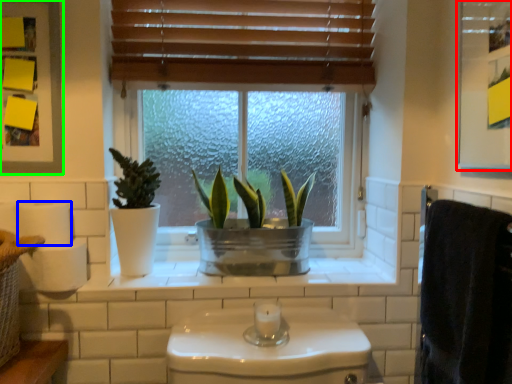
Question: Which object is the farthest from medicine cabinet (highlighted by a red box)? Choose among these: toilet paper (highlighted by a blue box) or medicine cabinet (highlighted by a green box).

Choices:
 (A) toilet paper
 (B) medicine cabinet

Answer: (A)